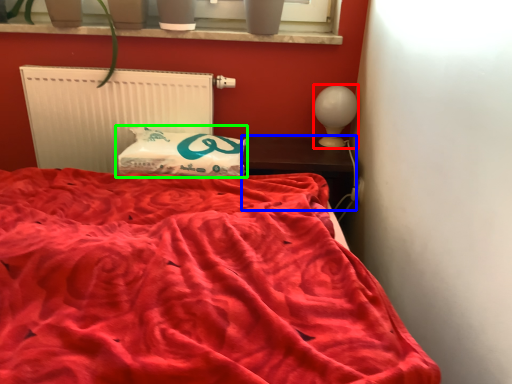
Question: Considering the real-world distances, which object is closest to table lamp (highlighted by a red box)? furniture (highlighted by a blue box) or pillow (highlighted by a green box).

Choices:
 (A) furniture
 (B) pillow

Answer: (A)